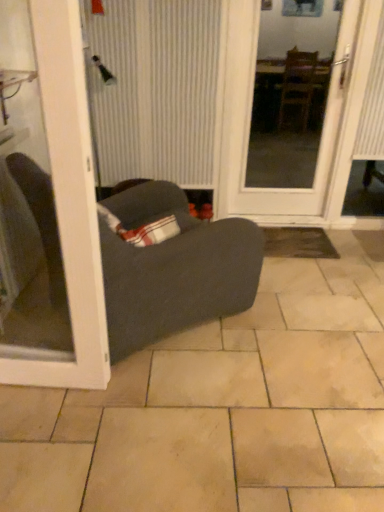
Find the location of a particular element. vacant space to the right of dark gray fabric studio couch at center is located at coordinates (298, 329).